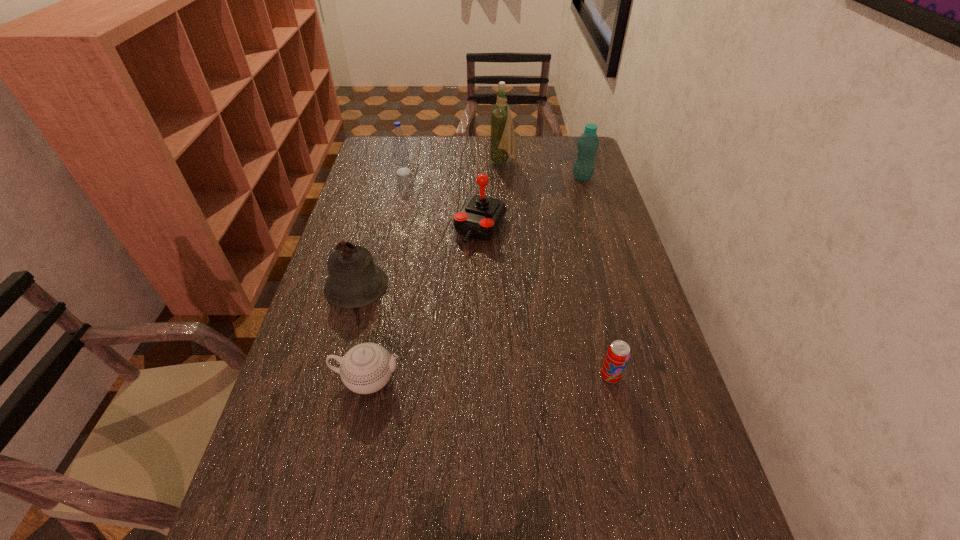
Locate an element on the screen. Image resolution: width=960 pixels, height=540 pixels. vacant space located 0.310m at the front cap of the right water bottle is located at coordinates (487, 178).

Image resolution: width=960 pixels, height=540 pixels. I want to click on vacant space located 0.240m at the front cap of the right water bottle, so click(x=506, y=178).

I want to click on free space located 0.340m at the front cap of the right water bottle, so click(478, 178).

Find the location of a particular element. The width and height of the screenshot is (960, 540). free space located 0.250m on the front of the left water bottle is located at coordinates (394, 218).

Identify the location of free space located on the back of the fourth farthest object. This screenshot has height=540, width=960. (481, 171).

Where is `free point located 0.110m on the front of the third nearest object`? Image resolution: width=960 pixels, height=540 pixels. free point located 0.110m on the front of the third nearest object is located at coordinates (341, 343).

Find the location of a particular element. vacant position located on the spout of the chinaware is located at coordinates (491, 379).

You are a GUI agent. You are given a task and a screenshot of the screen. Output one action in this format:
    pyautogui.click(x=<x>, y=<y>)
    Task: Click on the vacant region located on the left of the soda can
    This screenshot has height=540, width=960.
    Given the screenshot: What is the action you would take?
    pyautogui.click(x=548, y=376)

Where is `wine bottle present at the far edge`? The width and height of the screenshot is (960, 540). wine bottle present at the far edge is located at coordinates (502, 138).

Identify the location of water bottle at the far edge. (401, 154).